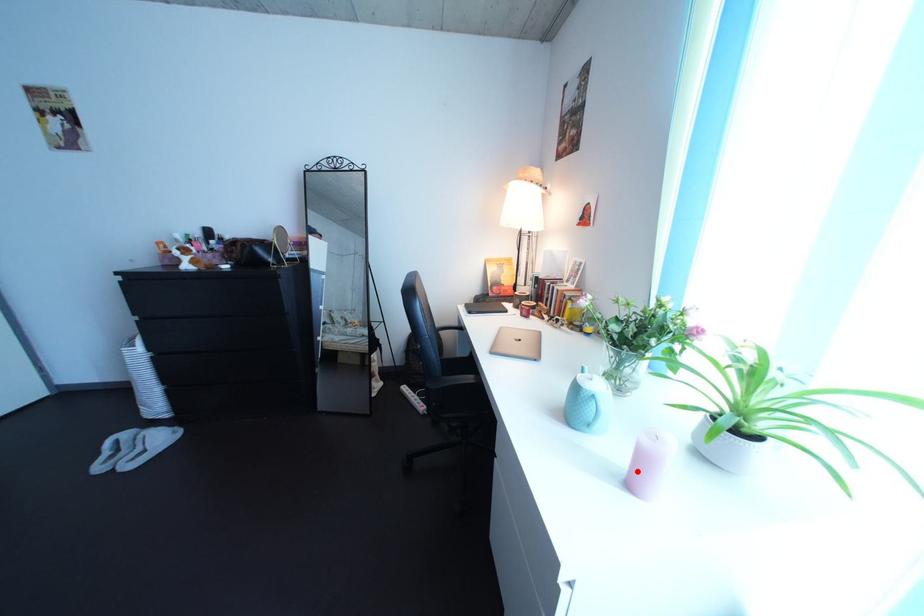
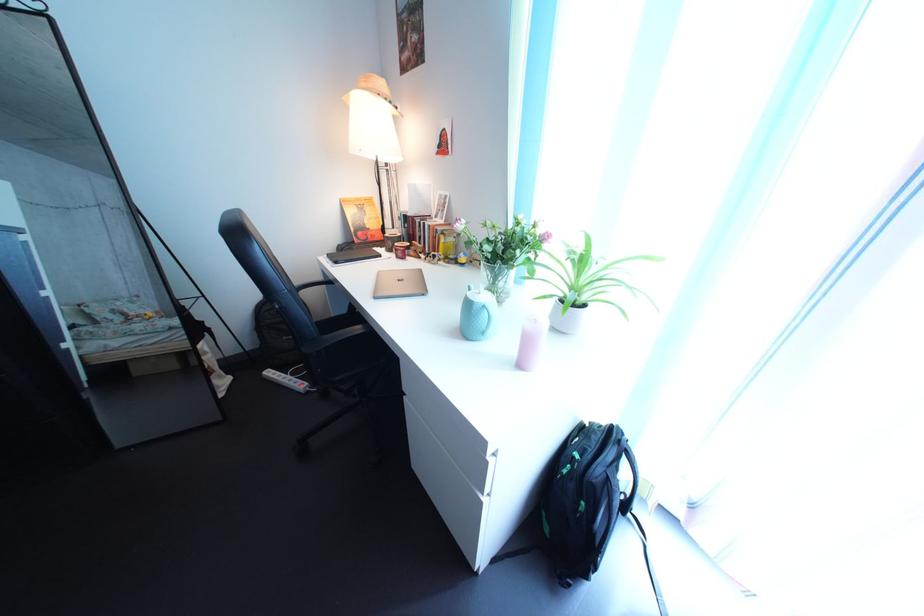
Locate, in the second image, the point that corresponds to the highlighted location in the first image.

(527, 360)